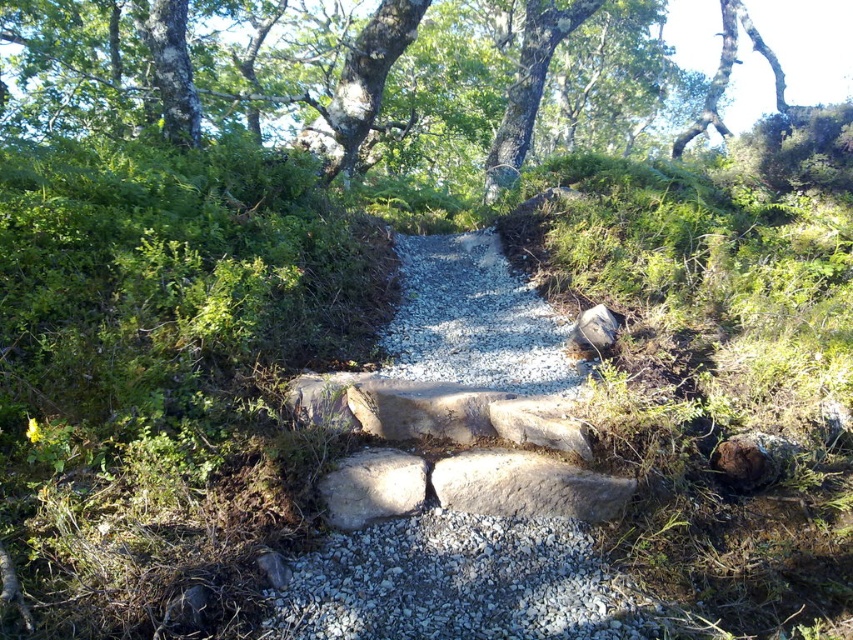
From the picture: You are standing at the edge of the gravel path in the forest scene. There is a gray rough stone at center located at point (372, 486). If you want to reach this stone, in which direction should you move from your current position?

The gray rough stone at center is located at point (372, 486), so you should move towards the center of the image to reach it.